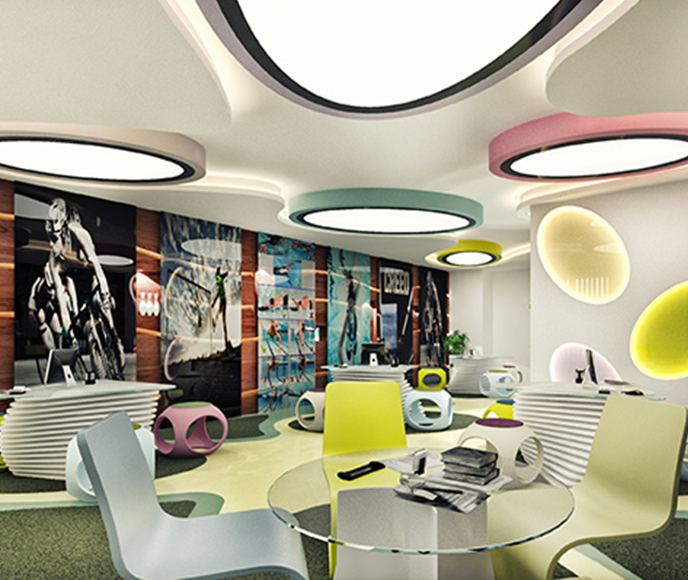
Find the location of `computer screen`. computer screen is located at coordinates (63, 360), (591, 369), (374, 347).